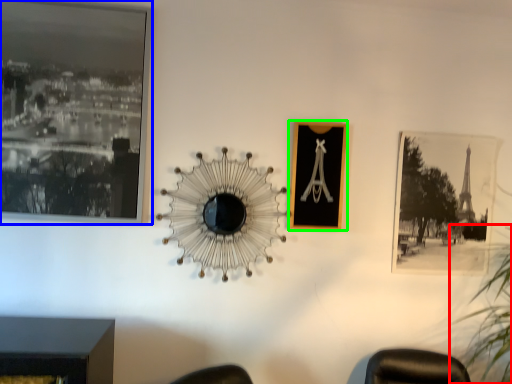
Question: Considering the real-world distances, which object is closest to plant (highlighted by a red box)? picture frame (highlighted by a blue box) or picture frame (highlighted by a green box).

Choices:
 (A) picture frame
 (B) picture frame

Answer: (B)